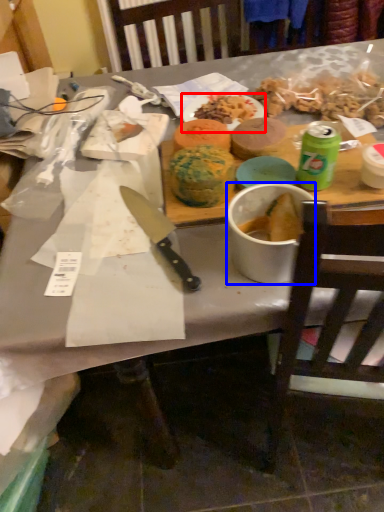
Question: Which object appears closest to the camera in this image, plate (highlighted by a red box) or bowl (highlighted by a blue box)?

Choices:
 (A) plate
 (B) bowl

Answer: (B)